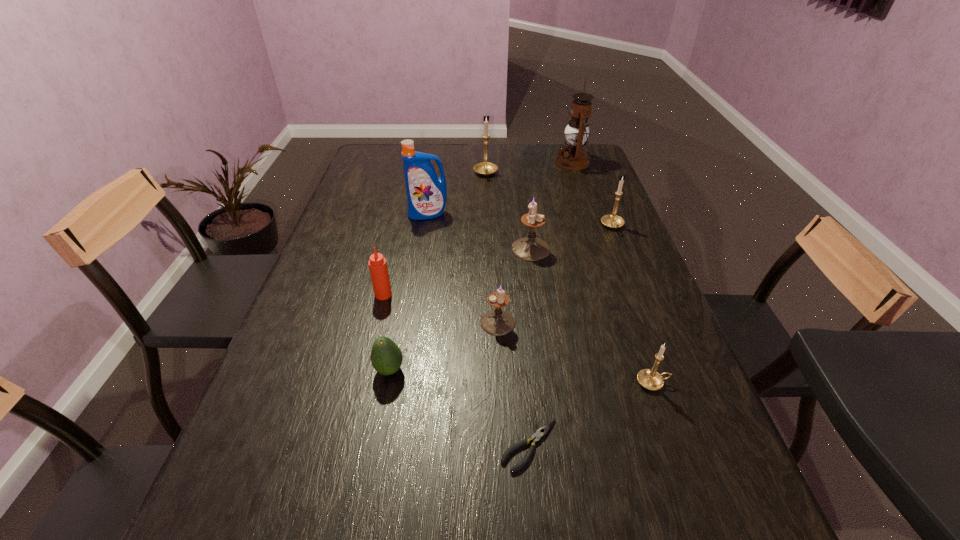
Where is `candle holder that is at the far edge`? The width and height of the screenshot is (960, 540). candle holder that is at the far edge is located at coordinates (485, 168).

Image resolution: width=960 pixels, height=540 pixels. I want to click on lantern at the right edge, so click(x=573, y=157).

At what (x,y) coordinates should I click in order to perform the action: click on object at the far right corner. Please return your answer as a coordinate pair (x, y). Looking at the image, I should click on (573, 157).

Find the location of a particular element. vacant space at the far edge of the desktop is located at coordinates (533, 148).

The image size is (960, 540). I want to click on free spot at the left edge of the desktop, so click(316, 261).

You are a GUI agent. You are given a task and a screenshot of the screen. Output one action in this format:
    pyautogui.click(x=<x>, y=<y>)
    Task: Click on the vacant space at the right edge of the desktop
    
    Given the screenshot: What is the action you would take?
    pyautogui.click(x=631, y=395)

Identify the location of free space between the lantern and the biggest gold candle holder. Image resolution: width=960 pixels, height=540 pixels. (529, 168).

Locate an element on the screen. The image size is (960, 540). vacant point located between the seventh farthest object and the nearest gold candle holder is located at coordinates (575, 353).

At what (x,y) coordinates should I click in order to perform the action: click on vacant space that is in between the fourth nearest candle holder and the detergent. Please return your answer as a coordinate pair (x, y). The width and height of the screenshot is (960, 540). Looking at the image, I should click on click(x=520, y=220).

You are a GUI agent. You are given a task and a screenshot of the screen. Output one action in this format:
    pyautogui.click(x=<x>, y=<y>)
    Task: Click on the vacant space that's between the farther purple candle holder and the lantern
    This screenshot has width=960, height=540.
    Given the screenshot: What is the action you would take?
    pyautogui.click(x=552, y=206)